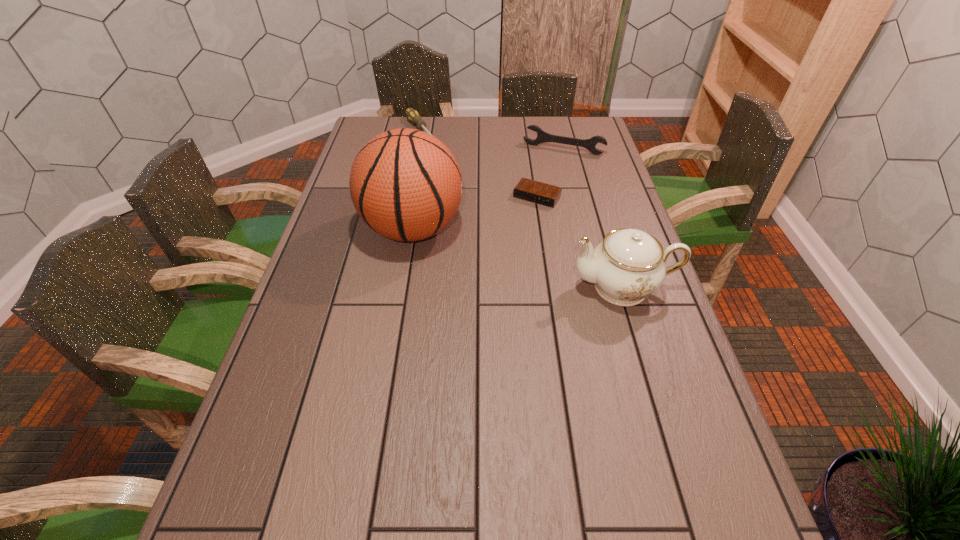
The height and width of the screenshot is (540, 960). Identify the location of vacant space located at the tip of the screwdriver. (440, 160).

You are a GUI agent. You are given a task and a screenshot of the screen. Output one action in this format:
    pyautogui.click(x=<x>, y=<y>)
    Task: Click on the vacant space located at the tip of the screwdriver
    The image size is (960, 540).
    Given the screenshot: What is the action you would take?
    pyautogui.click(x=447, y=168)

Image resolution: width=960 pixels, height=540 pixels. In order to click on blank space located on the open ends of the wrench in this screenshot , I will do `click(532, 210)`.

This screenshot has width=960, height=540. I want to click on free space located 0.170m on the open ends of the wrench, so click(542, 182).

I want to click on free space located 0.140m on the open ends of the wrench, so (x=544, y=177).

Identify the location of blank space located on the front face of the shortest object. pos(507,239).

The image size is (960, 540). I want to click on vacant region located 0.160m on the front face of the shortest object, so click(508, 238).

This screenshot has width=960, height=540. What are the coordinates of `free space located 0.190m on the front face of the shortest object` in the screenshot? It's located at (504, 244).

Locate an element on the screen. The width and height of the screenshot is (960, 540). screwdriver located at the far edge is located at coordinates point(413,116).

Image resolution: width=960 pixels, height=540 pixels. What are the coordinates of `wrench that is at the far edge` in the screenshot? It's located at (542, 136).